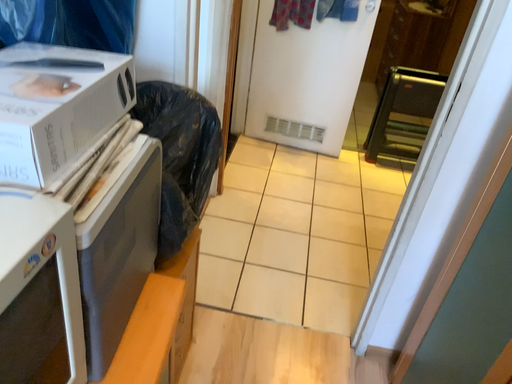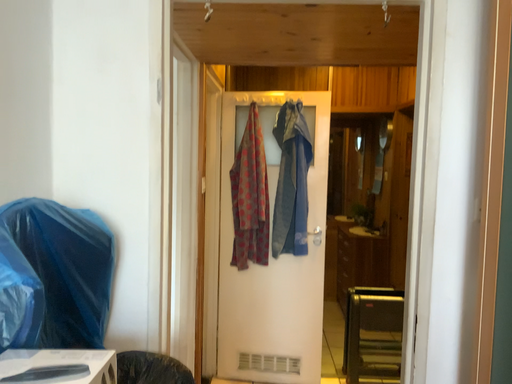
Question: How did the camera likely rotate when shooting the video?

Choices:
 (A) rotated downward
 (B) rotated upward

Answer: (B)